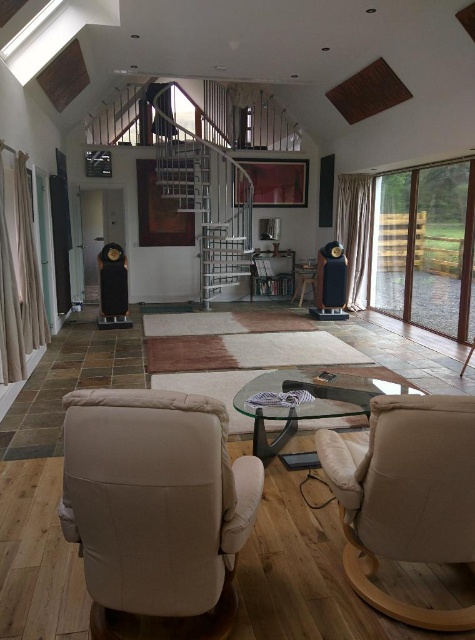
Is beige leather armchair at lower right positioned in front of transparent glass coffee table at center?

Yes, beige leather armchair at lower right is in front of transparent glass coffee table at center.

The image size is (475, 640). Find the location of `beige leather armchair at lower right`. beige leather armchair at lower right is located at coordinates (407, 496).

Locate an element on the screen. The height and width of the screenshot is (640, 475). beige leather armchair at lower right is located at coordinates coord(407,496).

Which is behind, point (406, 464) or point (449, 224)?

The point (449, 224) is behind.

Is point (417, 416) farther from viewer compared to point (461, 259)?

No, (417, 416) is in front of (461, 259).

Where is `beige leather armchair at lower right`? This screenshot has width=475, height=640. beige leather armchair at lower right is located at coordinates (407, 496).

Find the location of a particular element. beige leather armchair at lower right is located at coordinates (407, 496).

Is beige fabric armchair at lower left taller than transparent glass coffee table at center?

Yes.

Locate an element on the screen. Image resolution: width=475 pixels, height=640 pixels. beige fabric armchair at lower left is located at coordinates (155, 512).

This screenshot has width=475, height=640. Find the location of `beige fabric armchair at lower left`. beige fabric armchair at lower left is located at coordinates (155, 512).